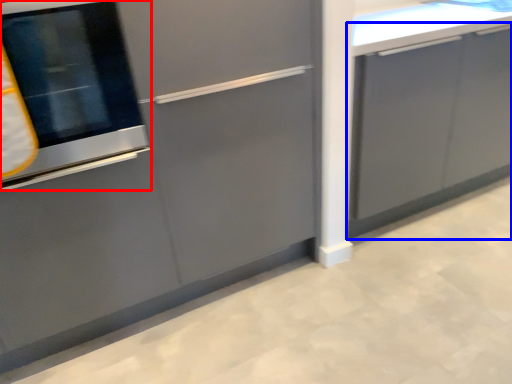
Question: Among these objects, which one is farthest to the camera, oven (highlighted by a red box) or cabinetry (highlighted by a blue box)?

Choices:
 (A) oven
 (B) cabinetry

Answer: (B)